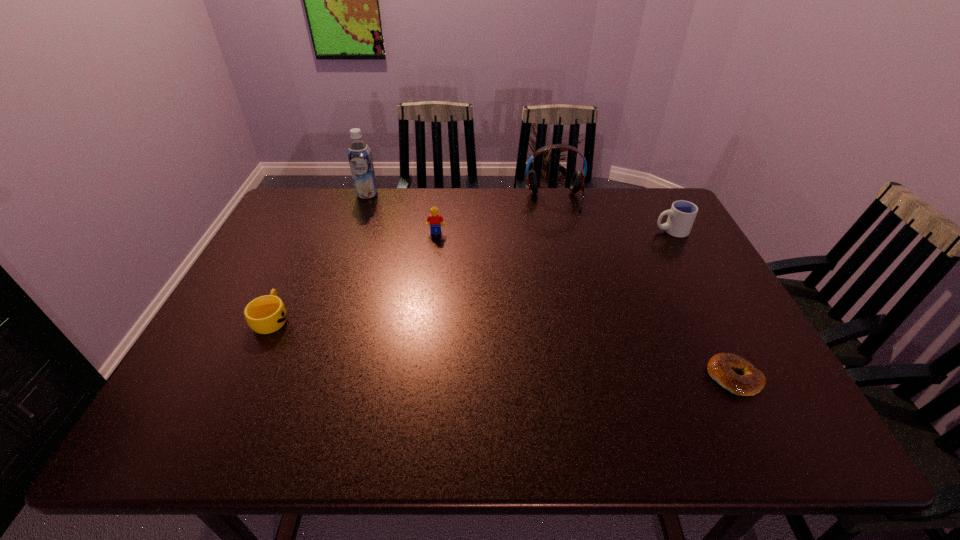
This screenshot has height=540, width=960. In order to click on bagel in this screenshot , I will do `click(721, 367)`.

Locate an element on the screen. The image size is (960, 540). blank space located 0.300m on the label of the soya milk is located at coordinates (345, 255).

Locate an element on the screen. The height and width of the screenshot is (540, 960). vacant area situated with the microphone attached to the side of the third object from right to left is located at coordinates (568, 259).

Where is `vacant space located 0.340m on the face of the third object from left to right`? This screenshot has width=960, height=540. vacant space located 0.340m on the face of the third object from left to right is located at coordinates (425, 317).

I want to click on free space located 0.140m with the handle on the side of the farther cup, so click(609, 231).

Locate an element on the screen. vacant area located 0.220m with the handle on the side of the farther cup is located at coordinates pos(583,231).

Identify the location of vacant space located with the handle on the side of the farther cup. This screenshot has height=540, width=960. (583, 231).

Image resolution: width=960 pixels, height=540 pixels. Identify the location of blank space located 0.360m on the right of the nearer cup. (437, 319).

You are a GUI agent. You are given a task and a screenshot of the screen. Output one action in this format:
    pyautogui.click(x=<x>, y=<y>)
    Task: Click on the free space located on the left of the bagel
    
    Given the screenshot: What is the action you would take?
    pyautogui.click(x=533, y=377)

The height and width of the screenshot is (540, 960). Find the location of `soya milk positioned at the far edge`. soya milk positioned at the far edge is located at coordinates (359, 154).